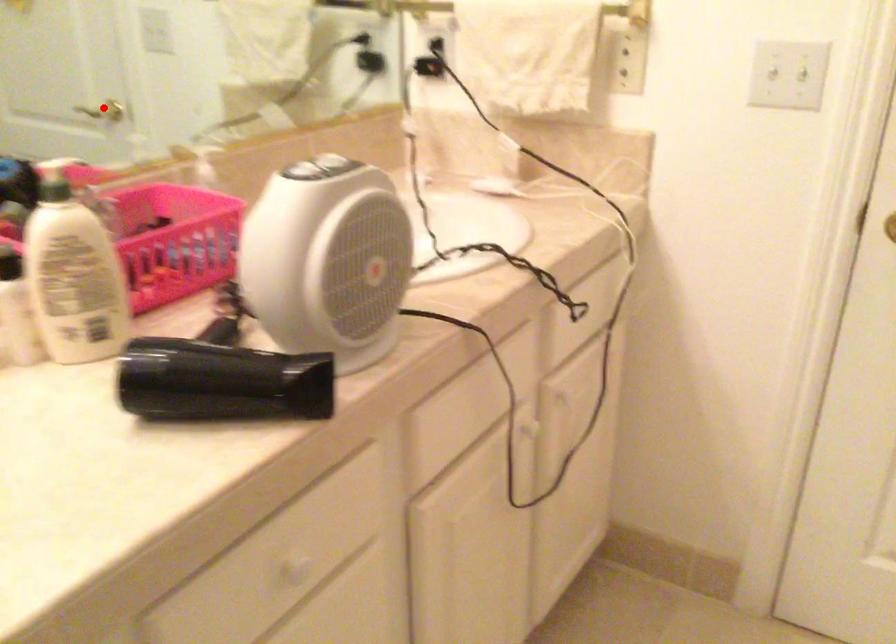
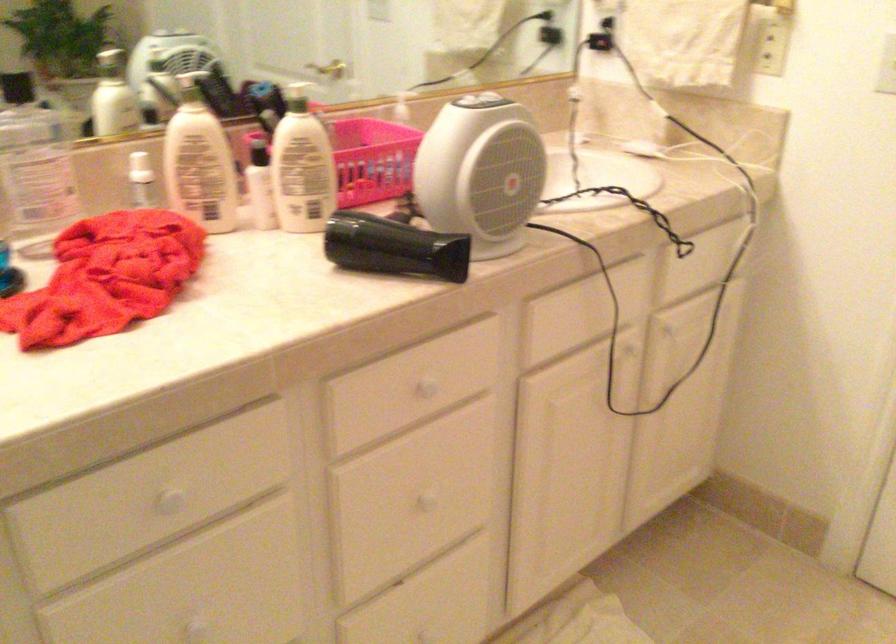
Locate, in the second image, the point that corresponds to the highlighted location in the first image.

(329, 69)